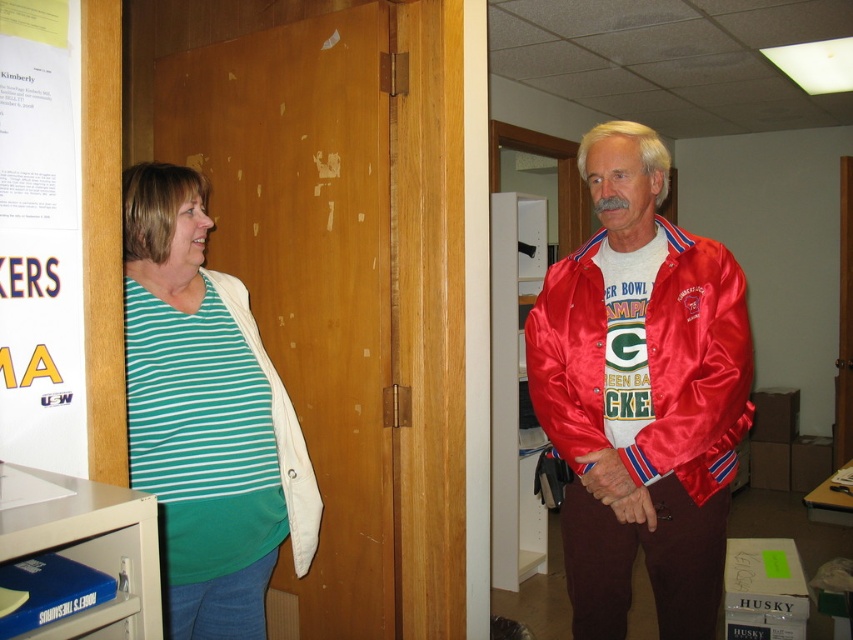
Does green matte bulletin board at left have a lesser width compared to satin red jacket at right?

No.

Looking at this image, can you confirm if green matte bulletin board at left is positioned above satin red jacket at right?

Yes.

Who is more forward, (393, 627) or (590, 500)?

Point (590, 500)

What are the coordinates of `green matte bulletin board at left` in the screenshot? It's located at (306, 266).

Measure the distance between satin red jacket at right and green striped shirt at left.

satin red jacket at right is 29.38 inches away from green striped shirt at left.

Locate an element on the screen. The height and width of the screenshot is (640, 853). satin red jacket at right is located at coordinates (641, 394).

Does green striped shirt at left have a smaller size compared to white paper poster at left?

No.

Who is higher up, green striped shirt at left or white paper poster at left?

white paper poster at left is above.

Is point (172, 554) in front of point (3, 390)?

No, (172, 554) is behind (3, 390).

What are the coordinates of `green striped shirt at left` in the screenshot? It's located at (206, 416).